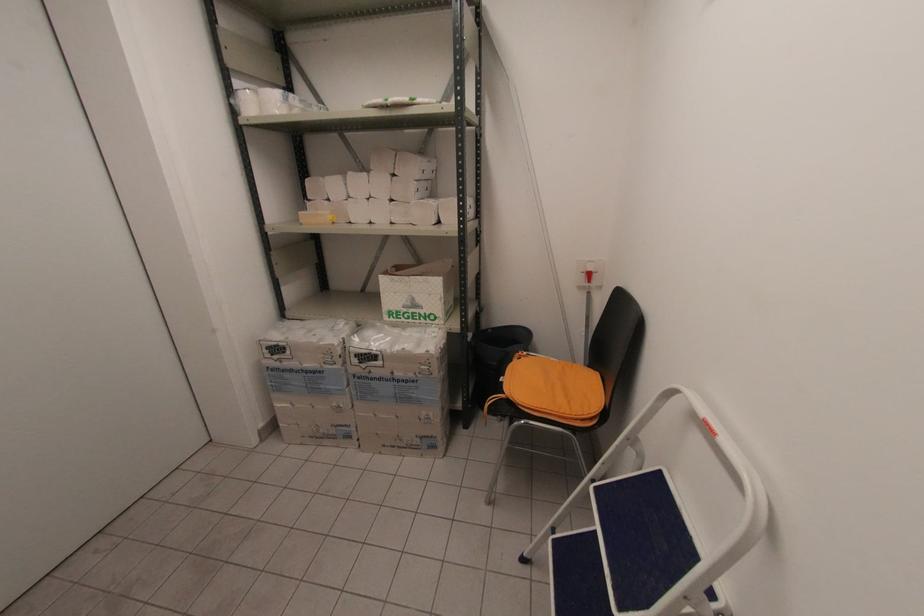
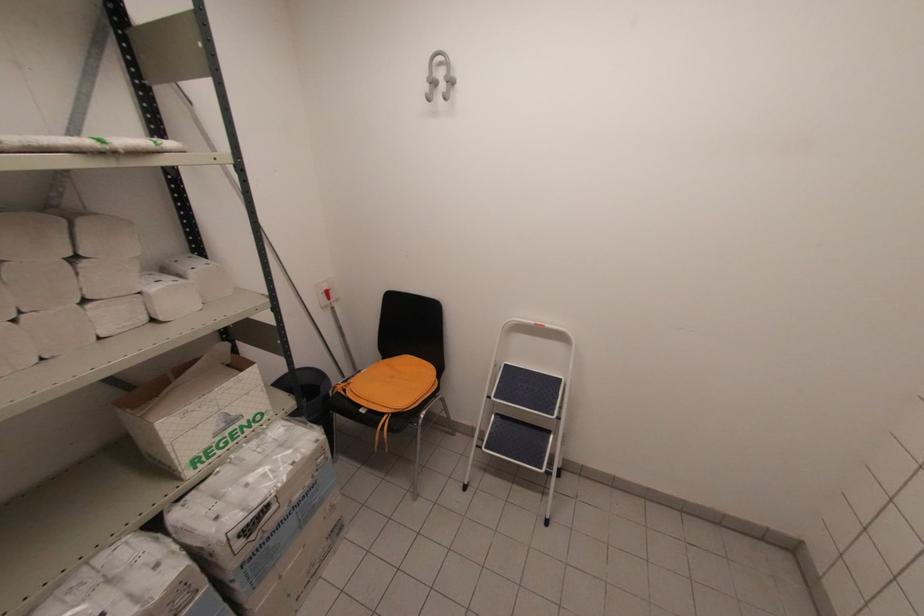
In the second image, find the point that corresponds to point 393,172 in the first image.

(71, 254)